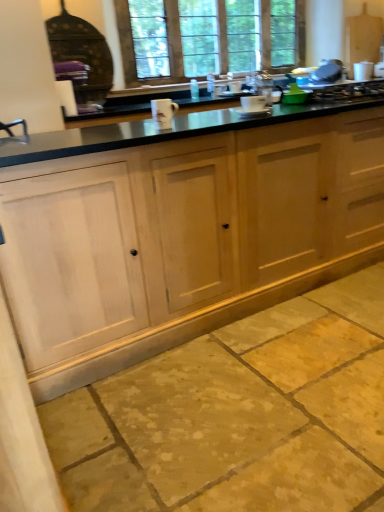
Describe the element at coordinates (347, 92) in the screenshot. Image resolution: width=384 pixels, height=512 pixels. I see `metallic silver gas stove at upper right` at that location.

In order to click on clear glass window at upper center in this screenshot , I will do [x=271, y=40].

Describe the element at coordinates (182, 238) in the screenshot. I see `natural wood cabinets at center` at that location.

Describe the element at coordinates (252, 103) in the screenshot. I see `white ceramic mug at center, which is the second appliance from left to right` at that location.

The width and height of the screenshot is (384, 512). What do you see at coordinates (163, 112) in the screenshot? I see `white ceramic mug at center, marked as the second appliance in a right-to-left arrangement` at bounding box center [163, 112].

Where is `natural stone floor at lower center`? natural stone floor at lower center is located at coordinates coord(239,415).

The height and width of the screenshot is (512, 384). What are the coordinates of `metallic silver gas stove at upper right` in the screenshot? It's located at (347, 92).

Can you confirm if white ceramic mug at center, which is the 1th appliance in bottom-to-top order, is thinner than white ceramic mug at center, which ranks as the second appliance in bottom-to-top order?

Correct, the width of white ceramic mug at center, which is the 1th appliance in bottom-to-top order, is less than that of white ceramic mug at center, which ranks as the second appliance in bottom-to-top order.

Does white ceramic mug at center, marked as the second appliance in a right-to-left arrangement, lie in front of white ceramic mug at center, placed as the 1th appliance when sorted from back to front?

Yes, white ceramic mug at center, marked as the second appliance in a right-to-left arrangement, is in front of white ceramic mug at center, placed as the 1th appliance when sorted from back to front.

Is white ceramic mug at center, which is the 2th appliance from top to bottom, next to white ceramic mug at center, which is the second appliance from left to right?

There is a gap between white ceramic mug at center, which is the 2th appliance from top to bottom, and white ceramic mug at center, which is the second appliance from left to right.

Relative to natural wood cabinets at center, is white ceramic mug at center, which is the 2th appliance from top to bottom, in front or behind?

Visually, white ceramic mug at center, which is the 2th appliance from top to bottom, is located behind natural wood cabinets at center.

Which of these two, white ceramic mug at center, which ranks as the 1th appliance in front-to-back order, or natural wood cabinets at center, is wider?

natural wood cabinets at center.

Is white ceramic mug at center, marked as the second appliance in a right-to-left arrangement, next to natural wood cabinets at center?

white ceramic mug at center, marked as the second appliance in a right-to-left arrangement, is not next to natural wood cabinets at center, and they're not touching.

You are a GUI agent. You are given a task and a screenshot of the screen. Output one action in this format:
    pyautogui.click(x=<x>, y=<y>)
    Task: Click on the 2nd appliance to the left of the metallic silver gas stove at upper right, starting your count from the anchor
    
    Given the screenshot: What is the action you would take?
    pyautogui.click(x=163, y=112)

From the image's perspective, between white ceramic mug at center, which is the 1th appliance in bottom-to-top order, and metallic silver gas stove at upper right, who is located below?

white ceramic mug at center, which is the 1th appliance in bottom-to-top order, is shown below in the image.

Is metallic silver gas stove at upper right completely or partially inside white ceramic mug at center, acting as the second appliance starting from the back?

That's incorrect, metallic silver gas stove at upper right is not inside white ceramic mug at center, acting as the second appliance starting from the back.

Is natural wood cabinets at center placed right next to clear glass window at upper center?

natural wood cabinets at center is not next to clear glass window at upper center, and they're not touching.

Considering the relative positions of natural wood cabinets at center and clear glass window at upper center in the image provided, is natural wood cabinets at center to the right of clear glass window at upper center from the viewer's perspective?

Indeed, natural wood cabinets at center is positioned on the right side of clear glass window at upper center.

Is natural wood cabinets at center outside of clear glass window at upper center?

Indeed, natural wood cabinets at center is completely outside clear glass window at upper center.

Is natural stone floor at lower center a part of metallic silver gas stove at upper right?

No, natural stone floor at lower center is not a part of metallic silver gas stove at upper right.

Would you consider metallic silver gas stove at upper right to be distant from natural stone floor at lower center?

That's right, there is a large distance between metallic silver gas stove at upper right and natural stone floor at lower center.

Considering the relative sizes of metallic silver gas stove at upper right and natural stone floor at lower center in the image provided, is metallic silver gas stove at upper right shorter than natural stone floor at lower center?

Incorrect, the height of metallic silver gas stove at upper right does not fall short of that of natural stone floor at lower center.

Which is more to the left, metallic silver gas stove at upper right or natural stone floor at lower center?

natural stone floor at lower center.

Considering the sizes of objects natural wood cabinets at center and metallic silver gas stove at upper right in the image provided, who is thinner, natural wood cabinets at center or metallic silver gas stove at upper right?

metallic silver gas stove at upper right is thinner.

From the image's perspective, who appears lower, natural wood cabinets at center or metallic silver gas stove at upper right?

From the image's view, natural wood cabinets at center is below.

Which object is further away from the camera taking this photo, natural wood cabinets at center or metallic silver gas stove at upper right?

metallic silver gas stove at upper right is further from the camera.

Between natural stone floor at lower center and white ceramic mug at center, placed as the 1th appliance when sorted from back to front, which one has smaller size?

With smaller size is white ceramic mug at center, placed as the 1th appliance when sorted from back to front.

Measure the distance from natural stone floor at lower center to white ceramic mug at center, which ranks as the second appliance in bottom-to-top order.

natural stone floor at lower center is 1.28 meters from white ceramic mug at center, which ranks as the second appliance in bottom-to-top order.

Consider the image. Is natural stone floor at lower center at the right side of white ceramic mug at center, placed as the 1th appliance when sorted from back to front?

Correct, you'll find natural stone floor at lower center to the right of white ceramic mug at center, placed as the 1th appliance when sorted from back to front.

Is natural stone floor at lower center looking in the opposite direction of white ceramic mug at center, the 1th appliance in the right-to-left sequence?

No, natural stone floor at lower center is not facing the opposite direction of white ceramic mug at center, the 1th appliance in the right-to-left sequence.

The width and height of the screenshot is (384, 512). Identify the location of appliance above the white ceramic mug at center, which ranks as the second appliance in bottom-to-top order (from a real-world perspective). (163, 112).

At what (x,y) coordinates should I click in order to perform the action: click on cabinetry below the white ceramic mug at center, which is the 2th appliance from top to bottom (from a real-world perspective). Please return your answer as a coordinate pair (x, y). Looking at the image, I should click on [182, 238].

Estimate the real-world distances between objects in this image. Which object is closer to metallic silver gas stove at upper right, white ceramic mug at center, which is the second appliance from left to right, or white ceramic mug at center, which is the 2th appliance from top to bottom?

white ceramic mug at center, which is the second appliance from left to right, is positioned closer to the anchor metallic silver gas stove at upper right.

Estimate the real-world distances between objects in this image. Which object is further from metallic silver gas stove at upper right, natural stone floor at lower center or clear glass window at upper center?

clear glass window at upper center is further to metallic silver gas stove at upper right.

Considering their positions, is natural stone floor at lower center positioned closer to natural wood cabinets at center than metallic silver gas stove at upper right?

The object closer to natural wood cabinets at center is natural stone floor at lower center.

Looking at the image, which one is located closer to natural stone floor at lower center, white ceramic mug at center, which is the second appliance from left to right, or metallic silver gas stove at upper right?

The object closer to natural stone floor at lower center is white ceramic mug at center, which is the second appliance from left to right.

Considering their positions, is metallic silver gas stove at upper right positioned further to natural wood cabinets at center than white ceramic mug at center, which is the 1th appliance in bottom-to-top order?

The object further to natural wood cabinets at center is metallic silver gas stove at upper right.

Based on their spatial positions, is natural stone floor at lower center or clear glass window at upper center further from white ceramic mug at center, which is counted as the first appliance, starting from the left?

Based on the image, clear glass window at upper center appears to be further to white ceramic mug at center, which is counted as the first appliance, starting from the left.

Looking at the image, which one is located closer to metallic silver gas stove at upper right, natural stone floor at lower center or white ceramic mug at center, placed as the 1th appliance when sorted from top to bottom?

white ceramic mug at center, placed as the 1th appliance when sorted from top to bottom, is closer to metallic silver gas stove at upper right.

Looking at the image, which one is located further to clear glass window at upper center, natural wood cabinets at center or natural stone floor at lower center?

Among the two, natural stone floor at lower center is located further to clear glass window at upper center.

Where is `cabinetry between natural stone floor at lower center and clear glass window at upper center along the z-axis`? cabinetry between natural stone floor at lower center and clear glass window at upper center along the z-axis is located at coordinates [x=182, y=238].

Locate an element on the screen. This screenshot has width=384, height=512. gas stove positioned between white ceramic mug at center, which is counted as the first appliance, starting from the left, and clear glass window at upper center from near to far is located at coordinates (347, 92).

The height and width of the screenshot is (512, 384). What are the coordinates of `appliance between white ceramic mug at center, acting as the second appliance starting from the back, and metallic silver gas stove at upper right, in the horizontal direction` in the screenshot? It's located at (252, 103).

The width and height of the screenshot is (384, 512). Identify the location of gas stove between natural stone floor at lower center and clear glass window at upper center along the z-axis. (347, 92).